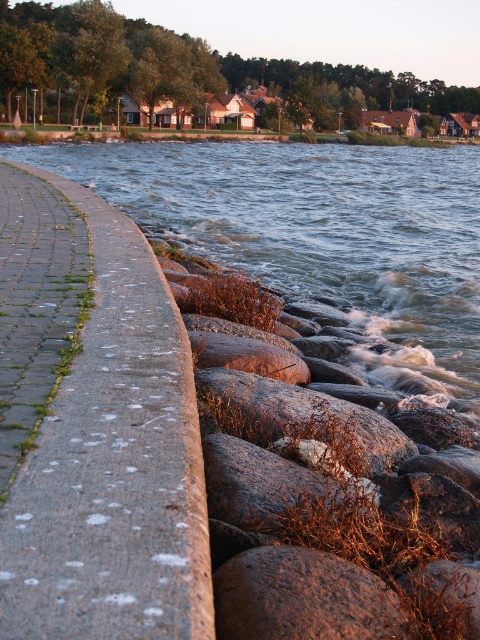
Based on the photo, you are a geologist examining the riverside scene. You need to locate the brown rough stone at lower center. According to the coordinates provided, where exactly is it positioned in the image?

The brown rough stone at lower center is positioned at coordinates point (302, 596).

You are standing at the center of the image and want to walk towards the clear water at lower right. Based on the 2D coordinates provided, in which direction should you move?

The clear water at lower right is located at coordinates point (322, 236). Since you are at the center, you should move towards the lower right direction to reach it.

You are standing at the riverside and see two points marked in the image. Which point is closer to you, point [217,636] or point [197,628]?

Point [217,636] is further to the viewer than point [197,628], so point [197,628] is closer to you.